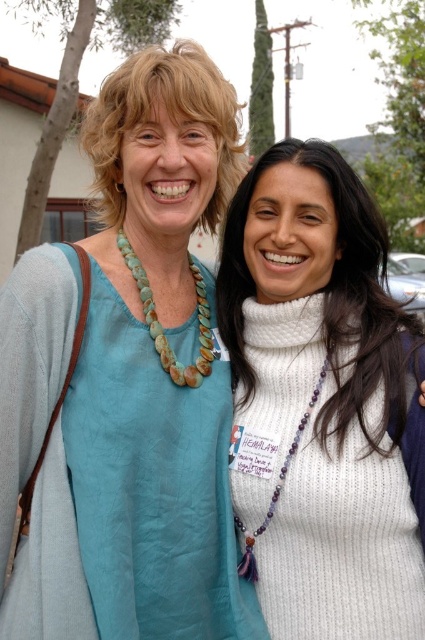
Question: Which of the following is the farthest from the observer?

Choices:
 (A) matte blue blouse at center
 (B) white knitted sweater at center
 (C) green stone necklace at center
 (D) purple beaded necklace at center

Answer: (C)

Question: Which object appears farthest from the camera in this image?

Choices:
 (A) white knitted sweater at center
 (B) purple beaded necklace at center

Answer: (B)

Question: Which object is the closest to the matte blue blouse at center?

Choices:
 (A) purple beaded necklace at center
 (B) green stone necklace at center

Answer: (B)

Question: Does white knitted sweater at center have a larger size compared to purple beaded necklace at center?

Choices:
 (A) yes
 (B) no

Answer: (A)

Question: Does matte blue blouse at center have a smaller size compared to white knitted sweater at center?

Choices:
 (A) yes
 (B) no

Answer: (B)

Question: Does white knitted sweater at center appear on the right side of green stone necklace at center?

Choices:
 (A) no
 (B) yes

Answer: (B)